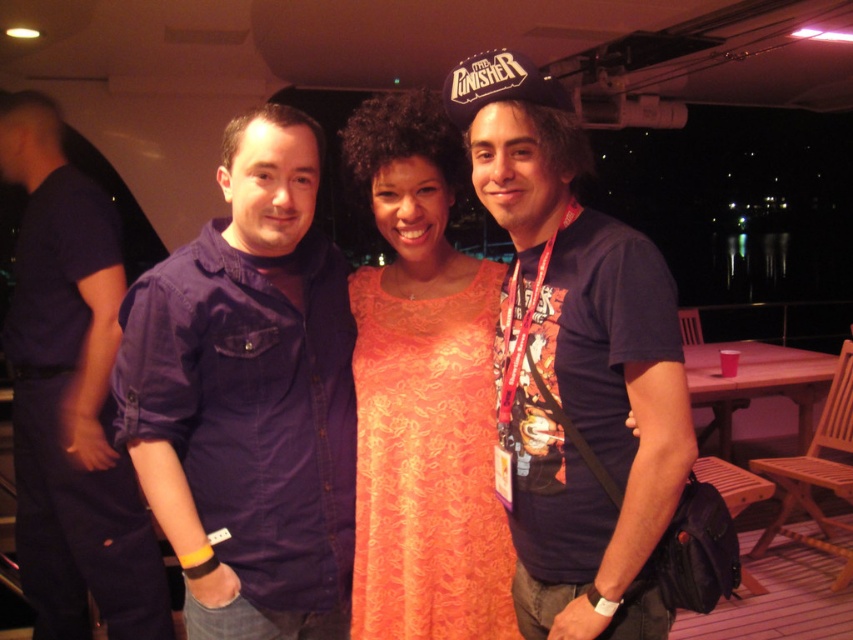
You are a photographer at the event and need to adjust the lighting to highlight the red lanyard at center. Based on the scene description, where exactly is the red lanyard positioned relative to the individuals?

The red lanyard at center is located at point coordinates 0.570 on the x axis and 0.675 on the y axis.

You are at a social event and want to find the red lanyard at center. Where should you look relative to the denim shirt at center?

The red lanyard at center is on the right side of the denim shirt at center.

You are organizing a charity event and need to ensure all participants have their lanyards visible. You notice the denim shirt at center and the red lanyard at center. Which object is wider?

The denim shirt at center is wider than the red lanyard at center.